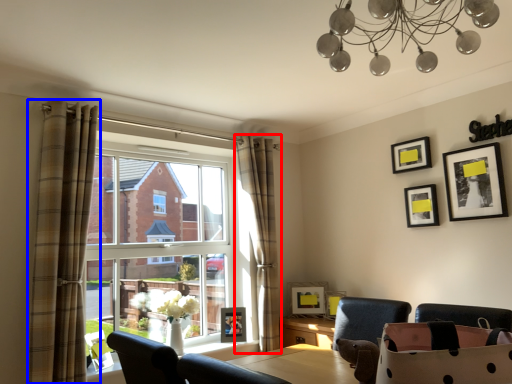
Question: Which object appears closest to the camera in this image, curtain (highlighted by a red box) or curtain (highlighted by a blue box)?

Choices:
 (A) curtain
 (B) curtain

Answer: (B)